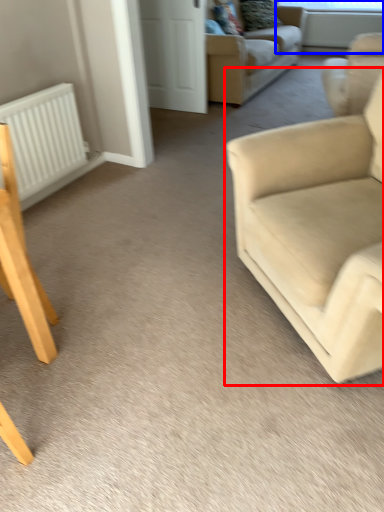
Question: Which point is closer to the camera, studio couch (highlighted by a red box) or window screen (highlighted by a blue box)?

Choices:
 (A) studio couch
 (B) window screen

Answer: (A)